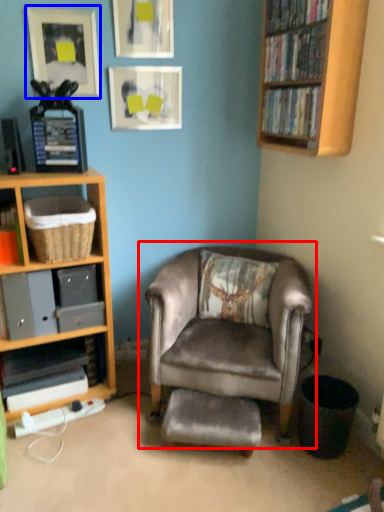
Question: Which object is further to the camera taking this photo, chair (highlighted by a red box) or picture frame (highlighted by a blue box)?

Choices:
 (A) chair
 (B) picture frame

Answer: (B)